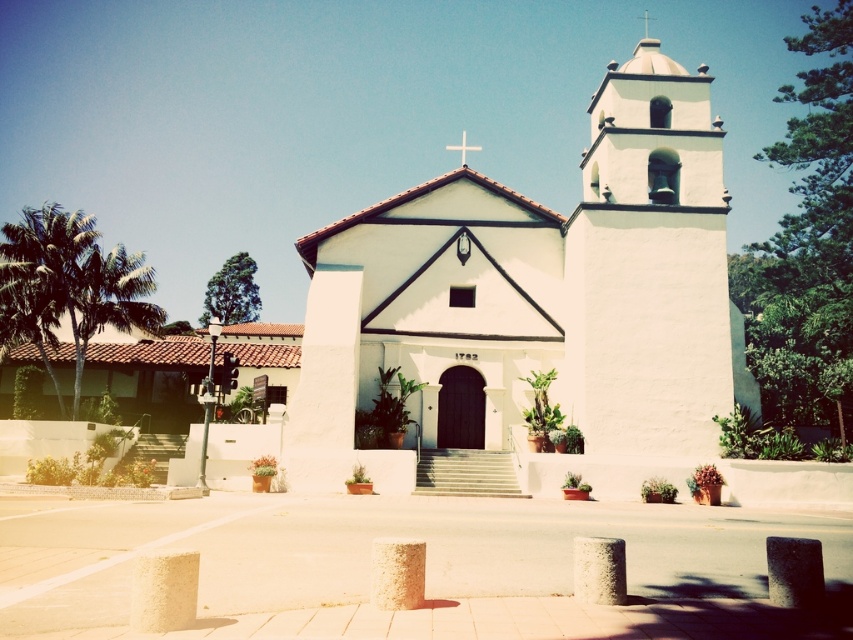
You are standing in front of the church and want to take a photo of both the white stucco chapel at center and the white cross at center. Which object should you position to the left side of your camera frame to include both in the picture?

You should position the white cross at center to the left side of your camera frame because the white stucco chapel at center is to the right of the white cross at center, so placing the cross on the left will allow both to fit in the frame.